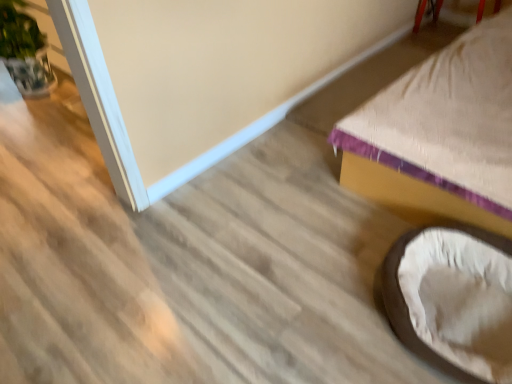
Question: Is beige fabric bed at lower right at the right side of soft beige fabric bean bag chair at lower right?

Choices:
 (A) yes
 (B) no

Answer: (A)

Question: Can you confirm if beige fabric bed at lower right is smaller than soft beige fabric bean bag chair at lower right?

Choices:
 (A) yes
 (B) no

Answer: (B)

Question: From the image's perspective, would you say beige fabric bed at lower right is shown under soft beige fabric bean bag chair at lower right?

Choices:
 (A) no
 (B) yes

Answer: (A)

Question: Is soft beige fabric bean bag chair at lower right surrounded by beige fabric bed at lower right?

Choices:
 (A) no
 (B) yes

Answer: (A)

Question: Does beige fabric bed at lower right have a greater width compared to soft beige fabric bean bag chair at lower right?

Choices:
 (A) yes
 (B) no

Answer: (A)

Question: Can you confirm if beige fabric bed at lower right is taller than soft beige fabric bean bag chair at lower right?

Choices:
 (A) yes
 (B) no

Answer: (A)

Question: Is beige fabric bed at lower right located within green leafy plant at left?

Choices:
 (A) no
 (B) yes

Answer: (A)

Question: Can you confirm if green leafy plant at left is wider than beige fabric bed at lower right?

Choices:
 (A) yes
 (B) no

Answer: (B)

Question: Does green leafy plant at left have a smaller size compared to beige fabric bed at lower right?

Choices:
 (A) no
 (B) yes

Answer: (B)

Question: From a real-world perspective, does green leafy plant at left sit lower than beige fabric bed at lower right?

Choices:
 (A) yes
 (B) no

Answer: (A)

Question: From the image's perspective, is green leafy plant at left on beige fabric bed at lower right?

Choices:
 (A) no
 (B) yes

Answer: (B)

Question: Considering the relative positions of green leafy plant at left and beige fabric bed at lower right in the image provided, is green leafy plant at left in front of beige fabric bed at lower right?

Choices:
 (A) no
 (B) yes

Answer: (A)

Question: Is green leafy plant at left bigger than soft beige fabric bean bag chair at lower right?

Choices:
 (A) yes
 (B) no

Answer: (A)